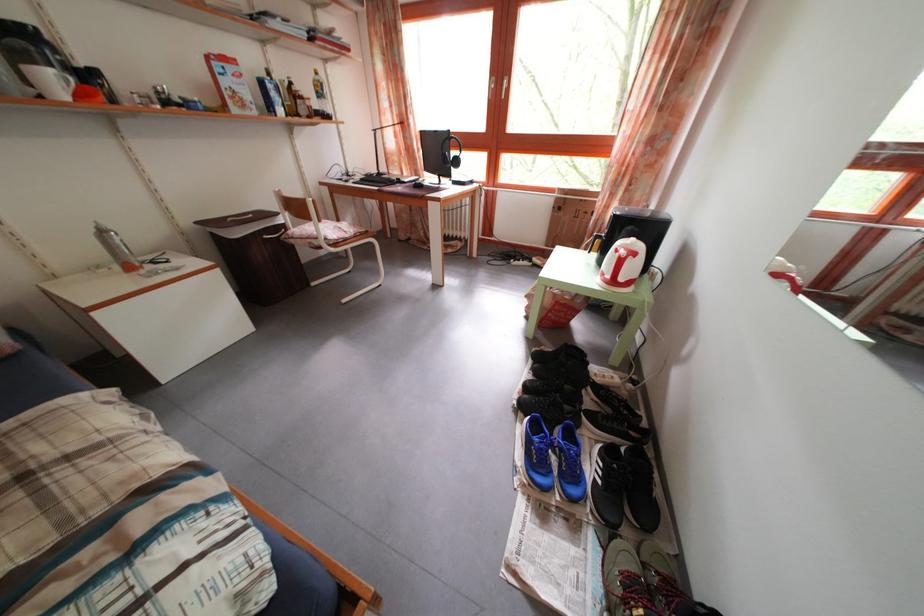
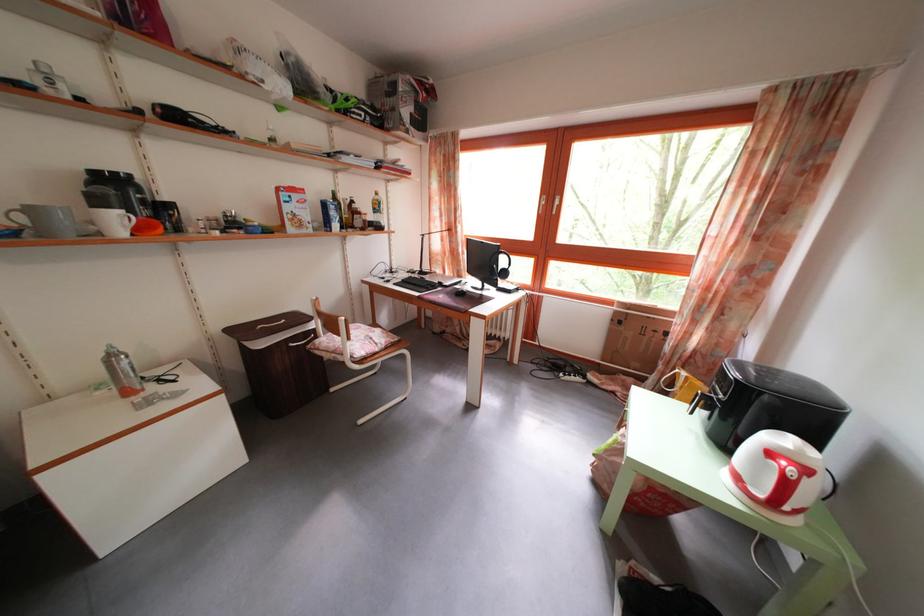
The images are taken continuously from a first-person perspective. In which direction are you moving?

The movement direction of the cameraman is left, forward.